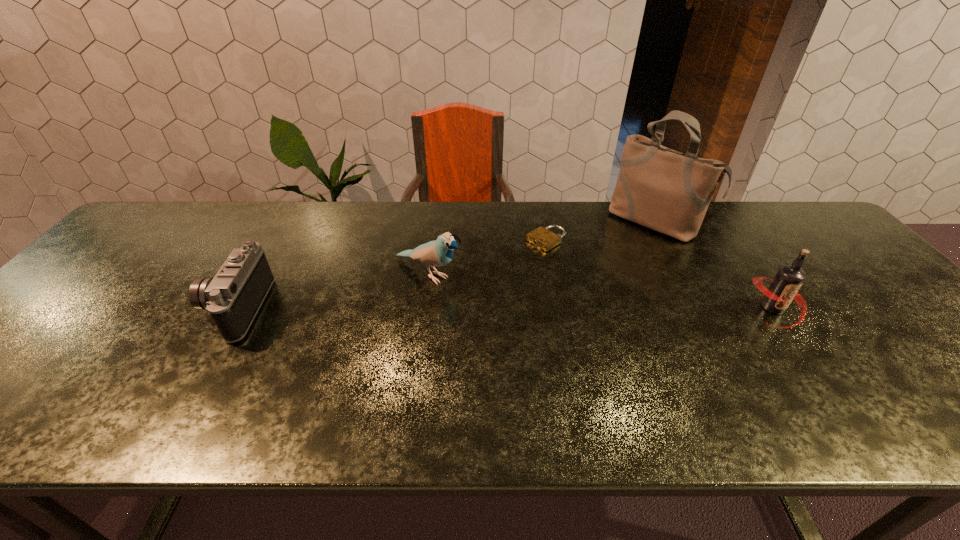
Find the location of a particular element. Image resolution: width=960 pixels, height=540 pixels. vacant space located 0.110m on the label of the root beer is located at coordinates (817, 369).

This screenshot has height=540, width=960. I want to click on vacant space situated 0.340m at the face of the fourth object from right to left, so click(x=571, y=345).

The image size is (960, 540). I want to click on vacant area situated at the face of the fourth object from right to left, so click(591, 356).

I want to click on vacant region located 0.270m at the face of the fourth object from right to left, so click(x=544, y=331).

Where is `vacant space positioned on the keyhole side of the padlock`? vacant space positioned on the keyhole side of the padlock is located at coordinates (476, 283).

The height and width of the screenshot is (540, 960). Identify the location of free space located on the keyhole side of the padlock. (520, 256).

The width and height of the screenshot is (960, 540). What are the coordinates of `vacant space positioned on the keyhole side of the padlock` in the screenshot? It's located at (427, 313).

Image resolution: width=960 pixels, height=540 pixels. Find the location of `blank space located 0.090m on the front-facing side of the tallest object`. blank space located 0.090m on the front-facing side of the tallest object is located at coordinates (622, 253).

I want to click on vacant region located on the front-facing side of the tallest object, so click(575, 305).

At what (x,y) coordinates should I click in order to perform the action: click on free space located 0.340m on the front-facing side of the tallest object. Please return your answer as a coordinate pair (x, y). Looking at the image, I should click on (579, 301).